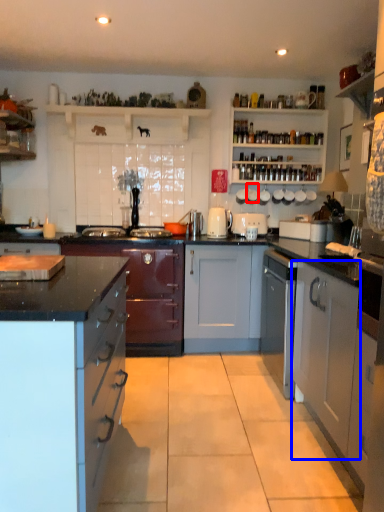
Question: Among these objects, which one is nearest to the camera, appliance (highlighted by a red box) or cabinetry (highlighted by a blue box)?

Choices:
 (A) appliance
 (B) cabinetry

Answer: (B)